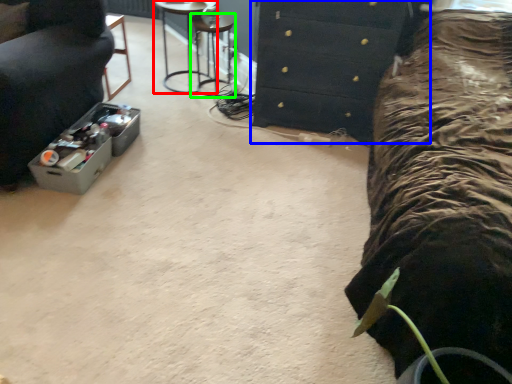
Question: Which is farther away from furniture (highlighted by a red box)? chest of drawers (highlighted by a blue box) or bar stool (highlighted by a green box)?

Choices:
 (A) chest of drawers
 (B) bar stool

Answer: (A)